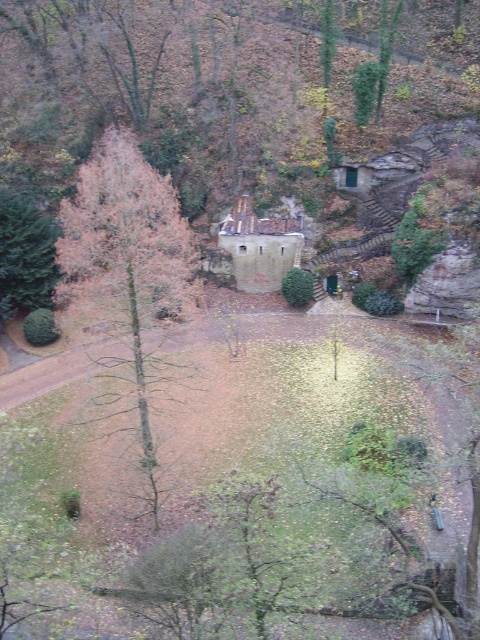
Question: Among these points, which one is nearest to the camera?

Choices:
 (A) (256, 177)
 (B) (60, 237)
 (C) (444, 241)

Answer: (B)

Question: Which is nearer to the brown stone castle at center?

Choices:
 (A) green leafy bush at center right
 (B) green matte tree at left
 (C) green leafy tree at upper center
 (D) brown leafy tree at left

Answer: (C)

Question: Which object appears farthest from the camera in this image?

Choices:
 (A) brown leafy tree at left
 (B) green matte tree at left
 (C) green leafy tree at upper center
 (D) green leafy bush at center right

Answer: (C)

Question: Is brown stone castle at center to the right of brown leafy tree at left from the viewer's perspective?

Choices:
 (A) yes
 (B) no

Answer: (A)

Question: In this image, where is green matte tree at left located relative to green leafy tree at upper center?

Choices:
 (A) left
 (B) right

Answer: (A)

Question: Does brown leafy tree at left appear on the right side of green matte tree at left?

Choices:
 (A) no
 (B) yes

Answer: (B)